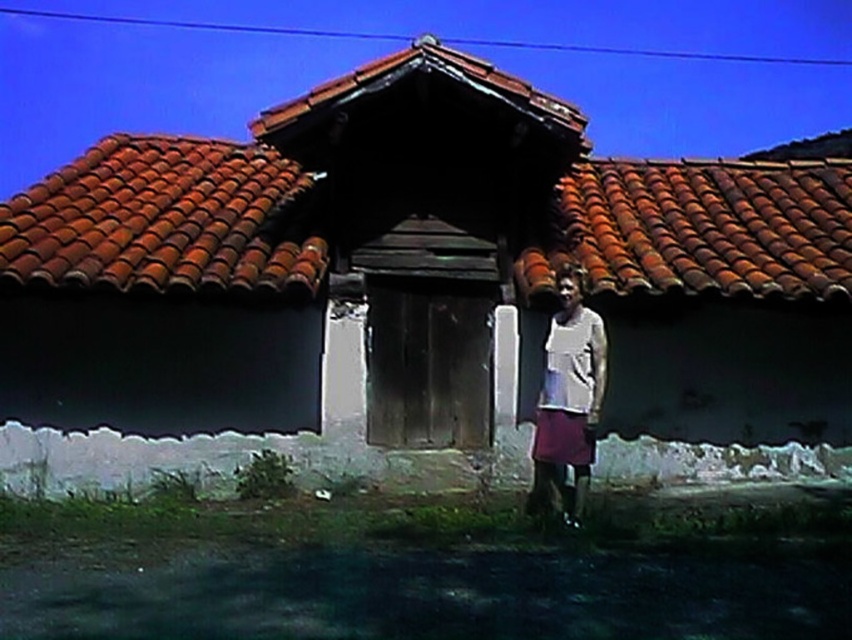
Question: Does brown tile roof at center appear on the left side of white matte shirt at right?

Choices:
 (A) yes
 (B) no

Answer: (B)

Question: Where is terracotta tiles at center located in relation to white matte shirt at right in the image?

Choices:
 (A) above
 (B) below

Answer: (A)

Question: Can you confirm if brown tile roof at center is positioned to the right of white matte shirt at right?

Choices:
 (A) no
 (B) yes

Answer: (B)

Question: Which object is farther from the camera taking this photo?

Choices:
 (A) white matte shirt at right
 (B) terracotta tiles at center
 (C) brown tile roof at center

Answer: (B)

Question: Which point is closer to the camera taking this photo?

Choices:
 (A) (395, 324)
 (B) (630, 262)

Answer: (B)

Question: Based on their relative distances, which object is nearer to the white matte shirt at right?

Choices:
 (A) brown tile roof at center
 (B) terracotta tiles at center

Answer: (A)